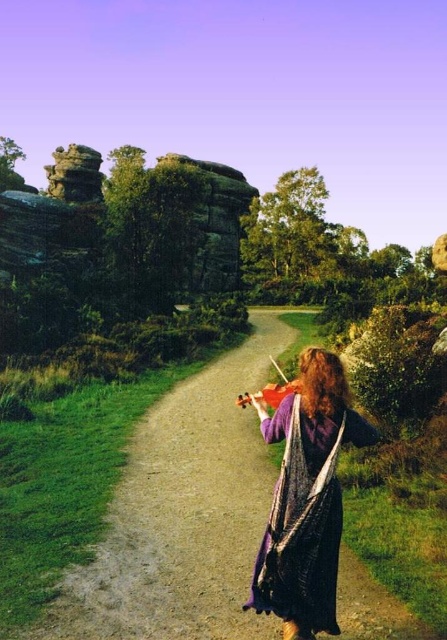
You are a photographer trying to capture the purple fabric at center and the wooden violin at center in a single frame. Based on their positions, which object is closer to the camera?

The purple fabric at center is positioned under the wooden violin at center, so the violin is closer to the camera than the fabric.

You are standing at the center of the dirt path in the scene. Which direction should you walk to reach the purple fabric at center?

The purple fabric at center is located at point (307, 499), so you should walk towards the direction of the point to reach it.